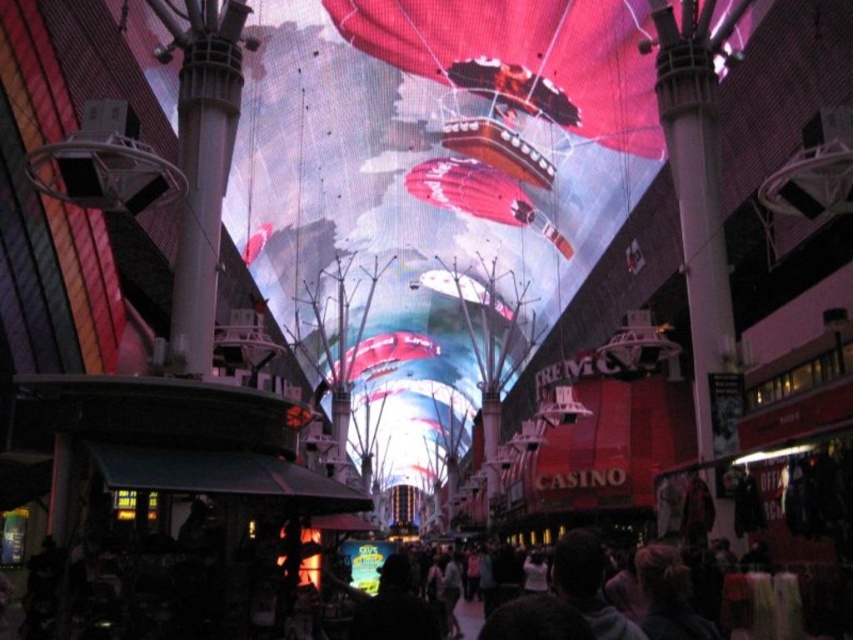
Is shiny metallic balloon at upper center to the right of shiny metallic balloon at center from the viewer's perspective?

Yes, shiny metallic balloon at upper center is to the right of shiny metallic balloon at center.

Between point (508, 22) and point (457, 182), which one is positioned behind?

The point (457, 182) is more distant.

Is point (514, 45) farther from viewer compared to point (497, 200)?

No, (514, 45) is closer to viewer.

The height and width of the screenshot is (640, 853). In order to click on shiny metallic balloon at upper center in this screenshot , I will do `click(524, 56)`.

Where is `shiny metallic balloon at upper center`? shiny metallic balloon at upper center is located at coordinates (524, 56).

Is point (390, 58) positioned after point (198, 180)?

Yes, it is behind point (198, 180).

Does point (527, 84) come behind point (234, 108)?

Yes, it is.

You are a GUI agent. You are given a task and a screenshot of the screen. Output one action in this format:
    pyautogui.click(x=<x>, y=<y>)
    Task: Click on the shiny metallic balloon at upper center
    This screenshot has width=853, height=640.
    Given the screenshot: What is the action you would take?
    pyautogui.click(x=524, y=56)

Which of these two, smooth gray pole at center or shiny metallic balloon at center, stands shorter?

Standing shorter between the two is shiny metallic balloon at center.

Between point (209, 262) and point (521, 212), which one is positioned in front?

Positioned in front is point (209, 262).

The image size is (853, 640). What are the coordinates of `smooth gray pole at center` in the screenshot? It's located at (202, 163).